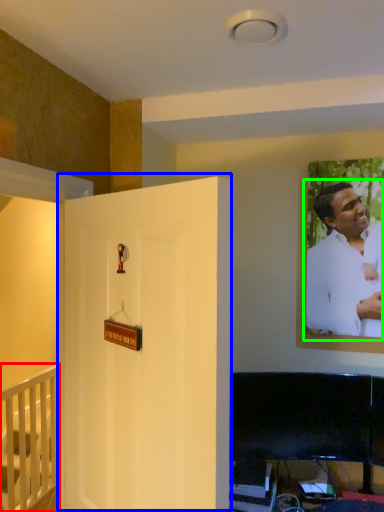
Question: Based on their relative distances, which object is nearer to furniture (highlighted by a red box)? Choose from door (highlighted by a blue box) and man (highlighted by a green box).

Choices:
 (A) door
 (B) man

Answer: (A)